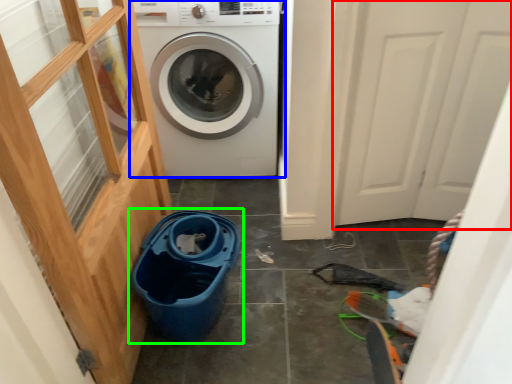
Question: Which object is positioned closest to screen door (highlighted by a red box)? Select from washing machine (highlighted by a blue box) and recycling bin (highlighted by a green box).

Choices:
 (A) washing machine
 (B) recycling bin

Answer: (A)